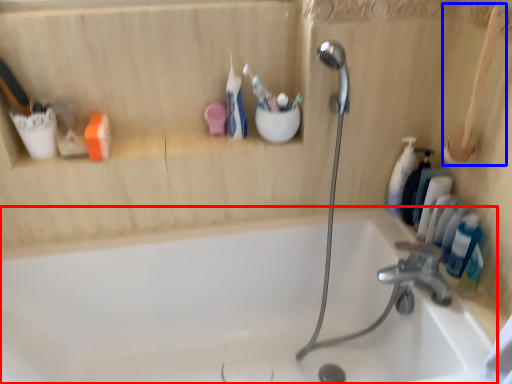
Question: Which of the following is the farthest to the observer, bathtub (highlighted by a red box) or brush (highlighted by a blue box)?

Choices:
 (A) bathtub
 (B) brush

Answer: (B)